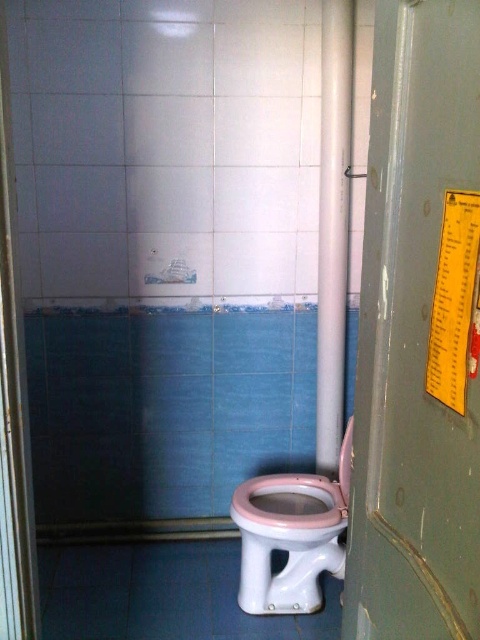
Question: Which of the following is the closest to the observer?

Choices:
 (A) white glossy pipe at center
 (B) green metallic pillar at right
 (C) white glossy tile at upper center

Answer: (B)

Question: Where is white glossy pipe at center located in relation to white glossy tile at upper center in the image?

Choices:
 (A) above
 (B) below

Answer: (B)

Question: From the image, what is the correct spatial relationship of green metallic pillar at right in relation to pink glossy toilet bowl at center?

Choices:
 (A) below
 (B) above

Answer: (B)

Question: Estimate the real-world distances between objects in this image. Which object is closer to the green metallic pillar at right?

Choices:
 (A) pink glossy toilet bowl at center
 (B) pink glossy toilet lid at center

Answer: (B)

Question: Is green metallic pillar at right smaller than white glossy pipe at center?

Choices:
 (A) yes
 (B) no

Answer: (A)

Question: Which object appears closest to the camera in this image?

Choices:
 (A) pink glossy toilet bowl at center
 (B) white glossy tile at upper center
 (C) green metallic pillar at right
 (D) white glossy pipe at center

Answer: (C)